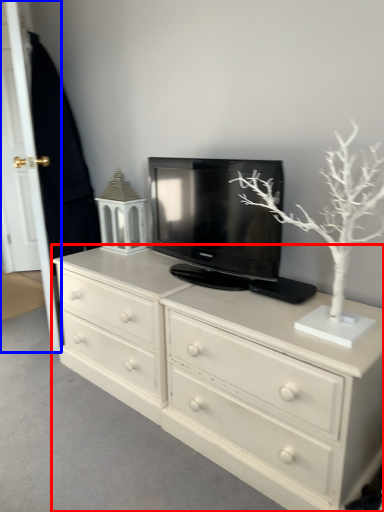
Question: Which point is closer to the camera, chest of drawers (highlighted by a red box) or door (highlighted by a blue box)?

Choices:
 (A) chest of drawers
 (B) door

Answer: (A)